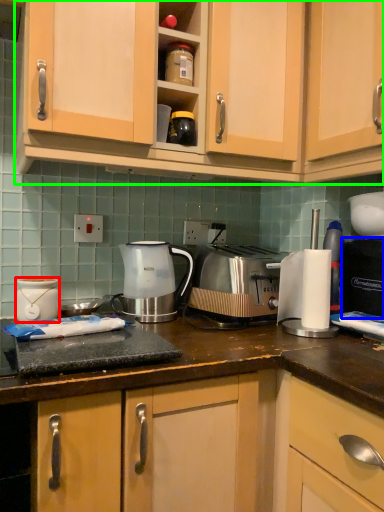
Question: Which object is positioned farthest from kitchen appliance (highlighted by a red box)? Select from home appliance (highlighted by a blue box) and cabinetry (highlighted by a green box).

Choices:
 (A) home appliance
 (B) cabinetry

Answer: (A)